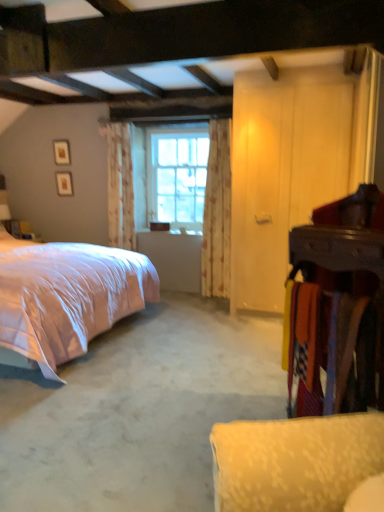
Measure the distance between wooden armoire at right and camera.

wooden armoire at right and camera are 5.06 feet apart from each other.

I want to click on wooden armoire at right, so click(x=351, y=294).

Measure the distance between point (150,197) and camera.

They are 4.89 meters apart.

What do you see at coordinates (138, 410) in the screenshot?
I see `white carpet at lower right` at bounding box center [138, 410].

Describe the element at coordinates (66, 296) in the screenshot. Image resolution: width=384 pixels, height=512 pixels. I see `pink satin bed at left` at that location.

You are a GUI agent. You are given a task and a screenshot of the screen. Output one action in this format:
    pyautogui.click(x=<x>, y=<y>)
    Task: Click on the wooden armoire at right
    
    Given the screenshot: What is the action you would take?
    click(x=351, y=294)

How different are the orientations of clear glass window at center and floral fabric curtain at center, which is counted as the 1th curtain, starting from the left, in degrees?

The angular difference between clear glass window at center and floral fabric curtain at center, which is counted as the 1th curtain, starting from the left, is 0.0333 degrees.

From the image's perspective, is clear glass window at center on top of floral fabric curtain at center, acting as the 2th curtain starting from the right?

Indeed, from the image's perspective, clear glass window at center is shown above floral fabric curtain at center, acting as the 2th curtain starting from the right.

Is clear glass window at center at the right side of floral fabric curtain at center, acting as the 2th curtain starting from the right?

Correct, you'll find clear glass window at center to the right of floral fabric curtain at center, acting as the 2th curtain starting from the right.

Is clear glass window at center positioned with its back to floral fabric curtain at center, acting as the 2th curtain starting from the right?

No, floral fabric curtain at center, acting as the 2th curtain starting from the right, is not at the back of clear glass window at center.

From the image's perspective, is clear glass window at center located beneath floral fabric curtain at center, arranged as the first curtain when viewed from the right?

Actually, clear glass window at center appears above floral fabric curtain at center, arranged as the first curtain when viewed from the right, in the image.

Between point (149, 215) and point (202, 250), which one is positioned behind?

The point (149, 215) is more distant.

Measure the distance from white carpet at lower right to clear glass window at center.

7.35 feet.

Is white carpet at lower right directly adjacent to clear glass window at center?

white carpet at lower right is not next to clear glass window at center, and they're not touching.

Is white carpet at lower right looking in the opposite direction of clear glass window at center?

No, white carpet at lower right is not facing the opposite direction of clear glass window at center.

What's the angular difference between white carpet at lower right and clear glass window at center's facing directions?

white carpet at lower right and clear glass window at center are facing 90 degrees away from each other.

Does wooden armoire at right have a smaller size compared to clear glass window at center?

Indeed, wooden armoire at right has a smaller size compared to clear glass window at center.

From a real-world perspective, which is physically above, wooden armoire at right or clear glass window at center?

clear glass window at center is physically above.

From the image's perspective, is wooden armoire at right over clear glass window at center?

Actually, wooden armoire at right appears below clear glass window at center in the image.

Looking at this image, considering the relative positions of wooden armoire at right and clear glass window at center in the image provided, is wooden armoire at right to the left or to the right of clear glass window at center?

wooden armoire at right is to the right of clear glass window at center.

Can you confirm if pink satin bed at left is smaller than floral fabric curtain at center, acting as the 2th curtain starting from the right?

No.

Are pink satin bed at left and floral fabric curtain at center, acting as the 2th curtain starting from the right, located far from each other?

pink satin bed at left is far away from floral fabric curtain at center, acting as the 2th curtain starting from the right.

Does pink satin bed at left have a lesser width compared to floral fabric curtain at center, which is counted as the 1th curtain, starting from the left?

In fact, pink satin bed at left might be wider than floral fabric curtain at center, which is counted as the 1th curtain, starting from the left.

Considering the relative positions of floral fabric curtain at center, arranged as the first curtain when viewed from the right, and white carpet at lower right in the image provided, is floral fabric curtain at center, arranged as the first curtain when viewed from the right, to the left of white carpet at lower right from the viewer's perspective?

In fact, floral fabric curtain at center, arranged as the first curtain when viewed from the right, is to the right of white carpet at lower right.

Is floral fabric curtain at center, arranged as the first curtain when viewed from the right, positioned far away from white carpet at lower right?

Indeed, floral fabric curtain at center, arranged as the first curtain when viewed from the right, is not near white carpet at lower right.

Which of these two, floral fabric curtain at center, placed as the 2th curtain when sorted from left to right, or white carpet at lower right, is wider?

white carpet at lower right is wider.

Is floral fabric curtain at center, arranged as the first curtain when viewed from the right, taller or shorter than white carpet at lower right?

Clearly, floral fabric curtain at center, arranged as the first curtain when viewed from the right, is taller compared to white carpet at lower right.

Considering the relative positions of wooden armoire at right and white carpet at lower right in the image provided, is wooden armoire at right to the left of white carpet at lower right from the viewer's perspective?

No, wooden armoire at right is not to the left of white carpet at lower right.

The image size is (384, 512). In order to click on concrete that appears on the left of wooden armoire at right in this screenshot , I will do `click(138, 410)`.

Does wooden armoire at right have a greater height compared to white carpet at lower right?

Yes, wooden armoire at right is taller than white carpet at lower right.

Where is `window above the floral fabric curtain at center, which is counted as the 1th curtain, starting from the left (from the image's perspective)`? window above the floral fabric curtain at center, which is counted as the 1th curtain, starting from the left (from the image's perspective) is located at coordinates (174, 176).

Locate an element on the screen. The height and width of the screenshot is (512, 384). window located behind the floral fabric curtain at center, placed as the 2th curtain when sorted from left to right is located at coordinates (174, 176).

When comparing their distances from clear glass window at center, does white carpet at lower right or floral fabric curtain at center, placed as the 2th curtain when sorted from left to right, seem further?

Among the two, white carpet at lower right is located further to clear glass window at center.

Which object lies further to the anchor point white carpet at lower right, pink satin bed at left or floral fabric curtain at center, acting as the 2th curtain starting from the right?

floral fabric curtain at center, acting as the 2th curtain starting from the right, is positioned further to the anchor white carpet at lower right.

Based on their spatial positions, is wooden armoire at right or floral fabric curtain at center, placed as the 2th curtain when sorted from left to right, closer to pink satin bed at left?

floral fabric curtain at center, placed as the 2th curtain when sorted from left to right, is closer to pink satin bed at left.

In the scene shown: From the image, which object appears to be farther from floral fabric curtain at center, placed as the 2th curtain when sorted from left to right, white carpet at lower right or clear glass window at center?

Based on the image, white carpet at lower right appears to be further to floral fabric curtain at center, placed as the 2th curtain when sorted from left to right.

In the scene shown: When comparing their distances from floral fabric curtain at center, placed as the 2th curtain when sorted from left to right, does pink satin bed at left or floral fabric curtain at center, acting as the 2th curtain starting from the right, seem further?

pink satin bed at left lies further to floral fabric curtain at center, placed as the 2th curtain when sorted from left to right, than the other object.

Considering their positions, is floral fabric curtain at center, placed as the 2th curtain when sorted from left to right, positioned further to white carpet at lower right than pink satin bed at left?

floral fabric curtain at center, placed as the 2th curtain when sorted from left to right, is positioned further to the anchor white carpet at lower right.

Looking at the image, which one is located closer to pink satin bed at left, floral fabric curtain at center, arranged as the first curtain when viewed from the right, or wooden armoire at right?

Among the two, floral fabric curtain at center, arranged as the first curtain when viewed from the right, is located nearer to pink satin bed at left.

Estimate the real-world distances between objects in this image. Which object is closer to pink satin bed at left, white carpet at lower right or wooden armoire at right?

Based on the image, white carpet at lower right appears to be nearer to pink satin bed at left.

This screenshot has height=512, width=384. I want to click on bed between white carpet at lower right and clear glass window at center along the z-axis, so click(x=66, y=296).

Where is `curtain located between pink satin bed at left and floral fabric curtain at center, acting as the 2th curtain starting from the right, in the depth direction`? This screenshot has height=512, width=384. curtain located between pink satin bed at left and floral fabric curtain at center, acting as the 2th curtain starting from the right, in the depth direction is located at coordinates tap(217, 213).

Locate an element on the screen. armoire between white carpet at lower right and floral fabric curtain at center, which is counted as the 1th curtain, starting from the left, from front to back is located at coordinates (351, 294).

Where is `bed between wooden armoire at right and clear glass window at center in the front-back direction`? bed between wooden armoire at right and clear glass window at center in the front-back direction is located at coordinates (66, 296).